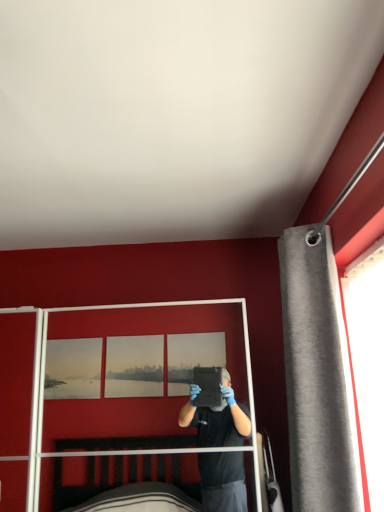
Question: Is gray fabric curtain at right bigger or smaller than clear plastic screen door at center?

Choices:
 (A) small
 (B) big

Answer: (A)

Question: Is gray fabric curtain at right in front of or behind clear plastic screen door at center in the image?

Choices:
 (A) front
 (B) behind

Answer: (A)

Question: From a real-world perspective, is gray fabric curtain at right above or below clear plastic screen door at center?

Choices:
 (A) above
 (B) below

Answer: (A)

Question: From the image's perspective, is clear plastic screen door at center located above or below gray fabric curtain at right?

Choices:
 (A) above
 (B) below

Answer: (B)

Question: From a real-world perspective, relative to gray fabric curtain at right, is clear plastic screen door at center vertically above or below?

Choices:
 (A) below
 (B) above

Answer: (A)

Question: Is point (104, 379) positioned closer to the camera than point (342, 391)?

Choices:
 (A) farther
 (B) closer

Answer: (A)

Question: From their relative heights in the image, would you say clear plastic screen door at center is taller or shorter than gray fabric curtain at right?

Choices:
 (A) short
 (B) tall

Answer: (A)